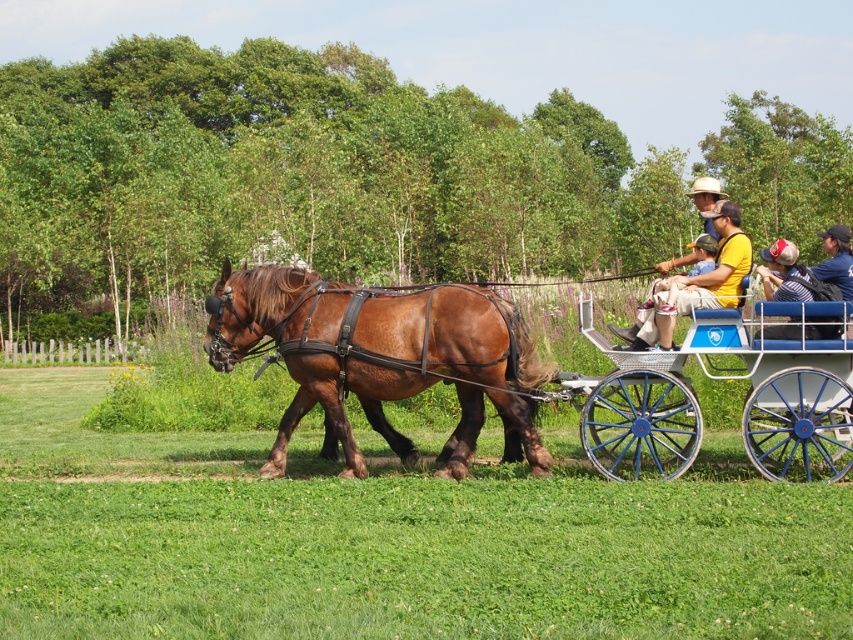
Can you confirm if denim jacket at center is wider than matte brown horse at center?

Incorrect, denim jacket at center's width does not surpass matte brown horse at center's.

Can you confirm if denim jacket at center is positioned above matte brown horse at center?

Incorrect, denim jacket at center is not positioned above matte brown horse at center.

Identify the location of denim jacket at center. (836, 259).

In the scene shown: Can you confirm if brown leather horse at center is taller than matte brown horse at center?

Incorrect, brown leather horse at center's height is not larger of matte brown horse at center's.

At what (x,y) coordinates should I click in order to perform the action: click on brown leather horse at center. Please return your answer as a coordinate pair (x, y). Looking at the image, I should click on (379, 356).

What are the coordinates of `brown leather horse at center` in the screenshot? It's located at (379, 356).

Does brown leather horse at center have a lesser width compared to denim jacket at center?

No, brown leather horse at center is not thinner than denim jacket at center.

Describe the element at coordinates (379, 356) in the screenshot. The height and width of the screenshot is (640, 853). I see `brown leather horse at center` at that location.

In the scene shown: Who is more distant from viewer, (x=544, y=458) or (x=839, y=253)?

The point (x=839, y=253) is behind.

At what (x,y) coordinates should I click in order to perform the action: click on brown leather horse at center. Please return your answer as a coordinate pair (x, y). Image resolution: width=853 pixels, height=640 pixels. Looking at the image, I should click on (379, 356).